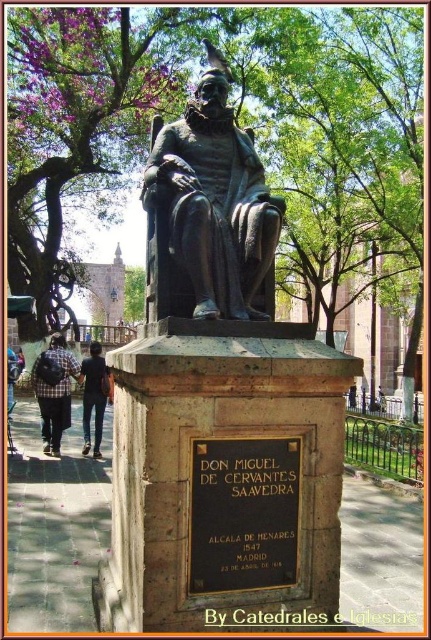
From the picture: You are a tourist visiting the bronze statue of Miguel de Cervantes. You notice the green leafy tree at upper center and the black polished stone plaque at center. Which object is higher in the image?

The green leafy tree at upper center is higher than the black polished stone plaque at center in the image.

You are a tourist standing in front of the statue of Miguel de Cervantes. You notice the green leafy tree at upper center and the black polished stone plaque at center. Which object is positioned to the left of the other?

The green leafy tree at upper center is to the left of the black polished stone plaque at center.

You are a photographer trying to capture the bronze statue of Miguel de Cervantes Saavedra. You notice the green leafy tree at upper center and the dark blue jeans at lower left in your frame. Which object is closer to the camera?

The green leafy tree at upper center is closer to the camera because the dark blue jeans at lower left is behind it.